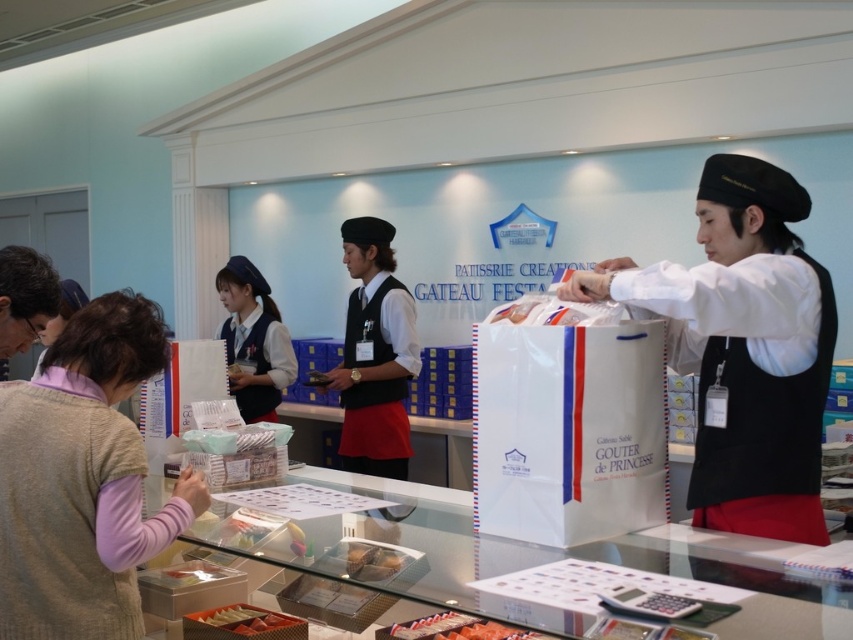
You are a customer at the bakery and want to know how far the point at the bottom right corner of the counter is from you. The coordinates of that point are given as point (x=71, y=616). Can you determine the distance?

The point (x=71, y=616) is 4.56 feet away from the viewer.

You are a customer in the bakery and want to ask about the princess theme pastries. Which staff member should you approach, the one wearing the knitted beige vest at lower left or the matte white uniform at center?

You should approach the matte white uniform at center because the knitted beige vest at lower left is not as tall as the matte white uniform at center, implying the latter is taller and more likely to be an employee.

You are a customer in the bakery and want to ask the staff about the princess themed treats. Which staff member should you approach, the one wearing the knitted beige vest at lower left or the matte white uniform at center?

You should approach the staff member wearing the matte white uniform at center because the knitted beige vest at lower left is positioned on the right side of matte white uniform at center, meaning the matte white uniform at center is to the left and closer to the customer.